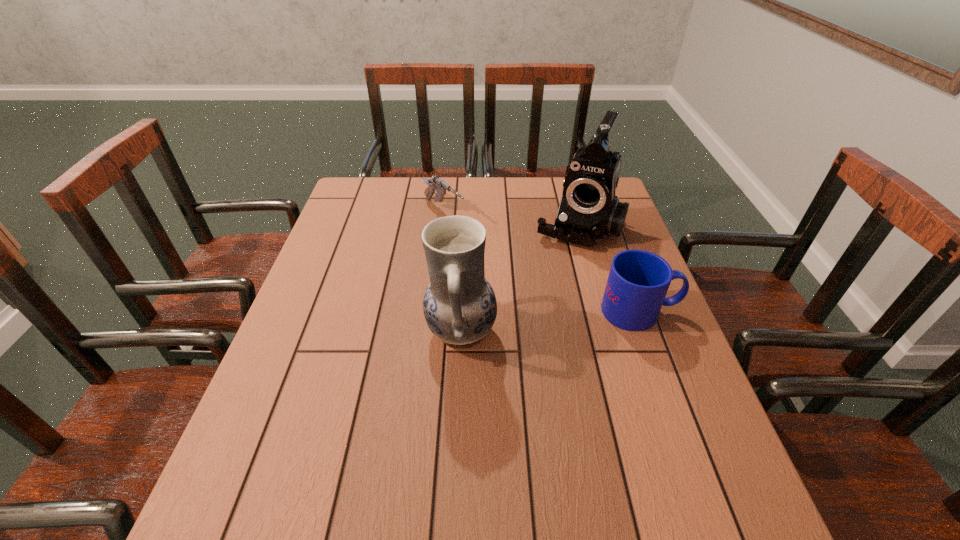
Identify the location of blank space at the far left corner of the desktop. Image resolution: width=960 pixels, height=540 pixels. (391, 185).

Where is `vacant space at the near right corner of the desktop`? The height and width of the screenshot is (540, 960). vacant space at the near right corner of the desktop is located at coordinates (681, 474).

I want to click on free space that is in between the mug and the pottery, so click(550, 322).

The height and width of the screenshot is (540, 960). Find the location of `vacant area between the pottery and the mug`. vacant area between the pottery and the mug is located at coordinates click(x=550, y=322).

The width and height of the screenshot is (960, 540). In order to click on free space between the third tallest object and the pottery in this screenshot , I will do `click(550, 322)`.

The image size is (960, 540). I want to click on empty space that is in between the camcorder and the pottery, so click(x=520, y=279).

Identify the location of free spot between the mug and the pottery. The image size is (960, 540). (550, 322).

The width and height of the screenshot is (960, 540). In order to click on free space between the camcorder and the pottery in this screenshot , I will do `click(520, 279)`.

Locate an element on the screen. Image resolution: width=960 pixels, height=540 pixels. free spot between the camcorder and the pottery is located at coordinates (520, 279).

In order to click on object that is the closest one to the camcorder in this screenshot , I will do point(638,281).